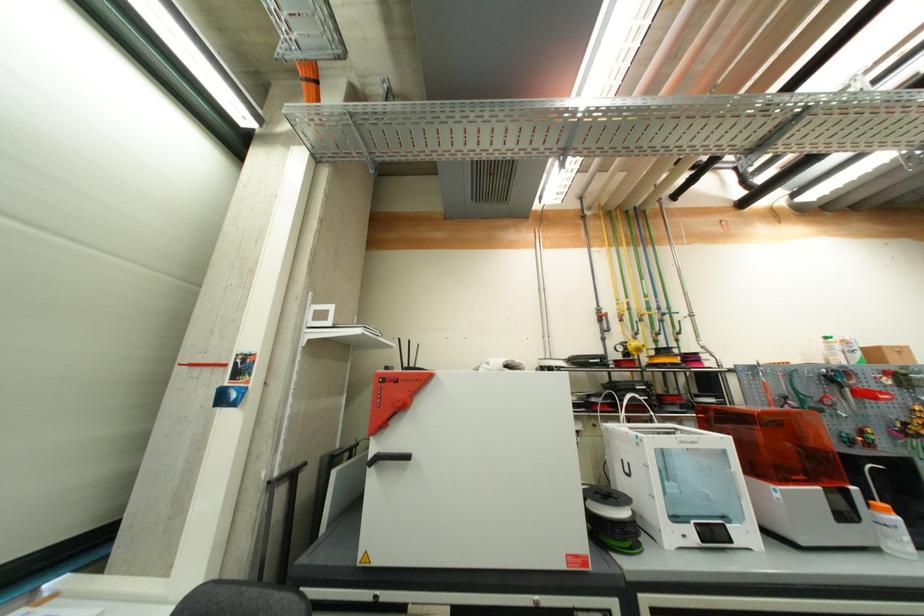
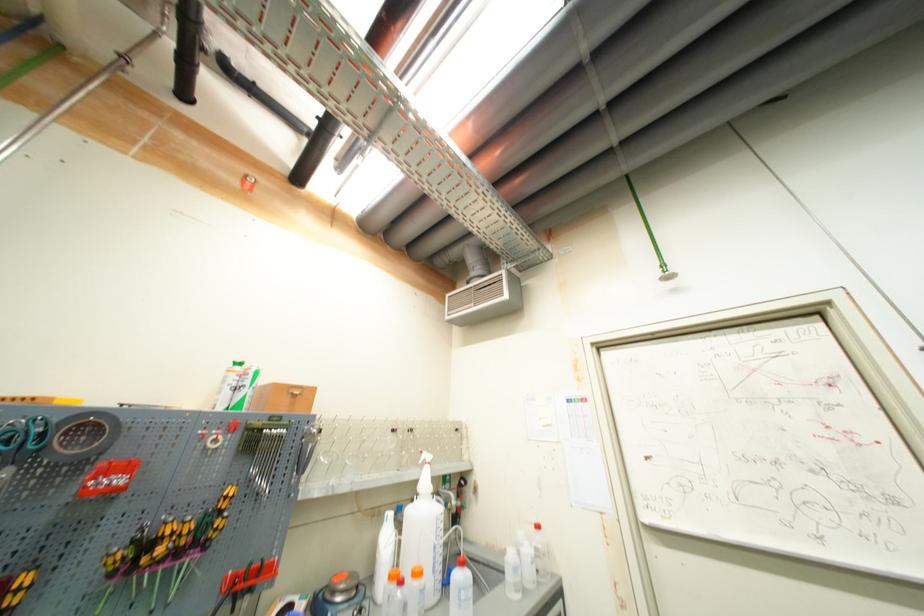
In the second image, find the point that corresponds to the point at 874,432 in the first image.

(30, 581)